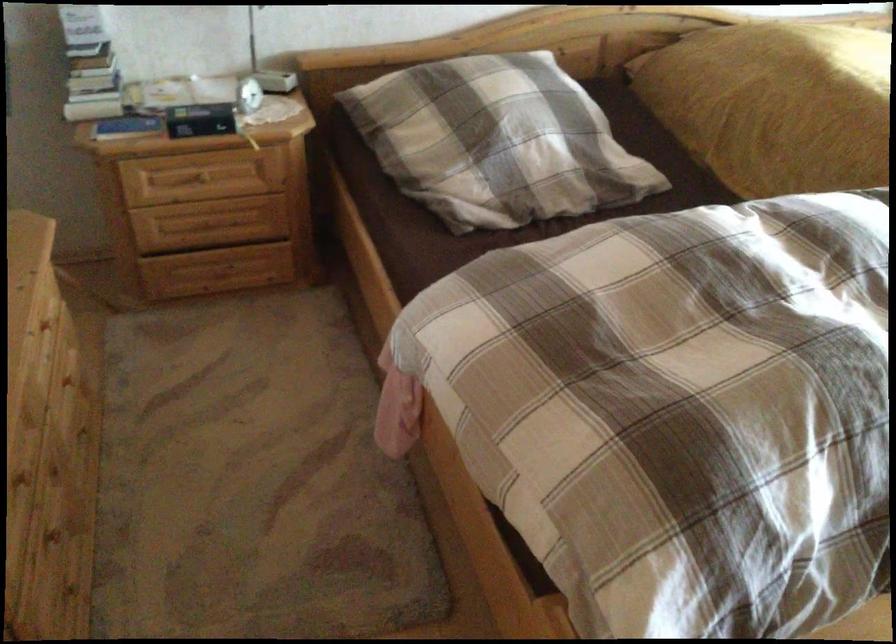
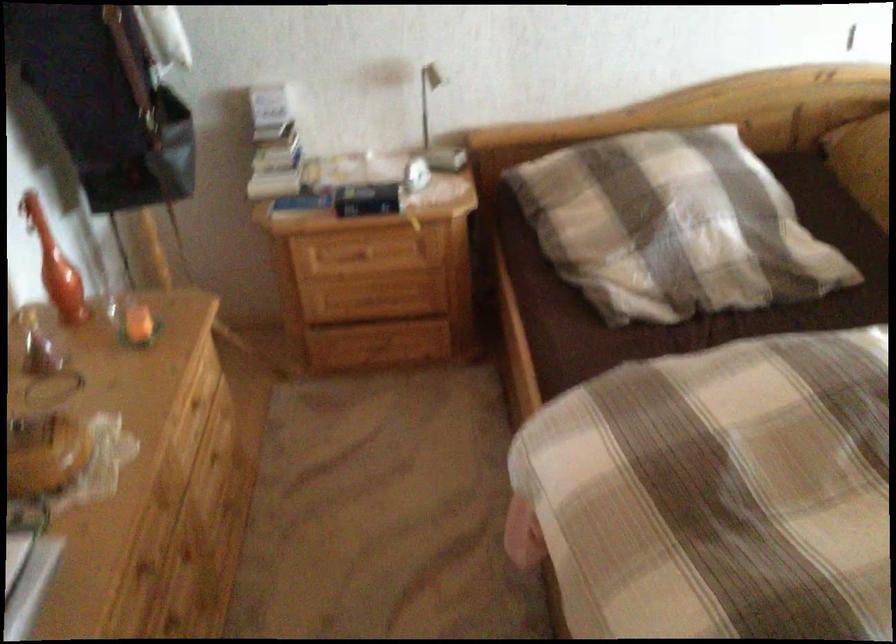
In the second image, find the point that corresponds to pixel 97 71 in the first image.

(276, 145)